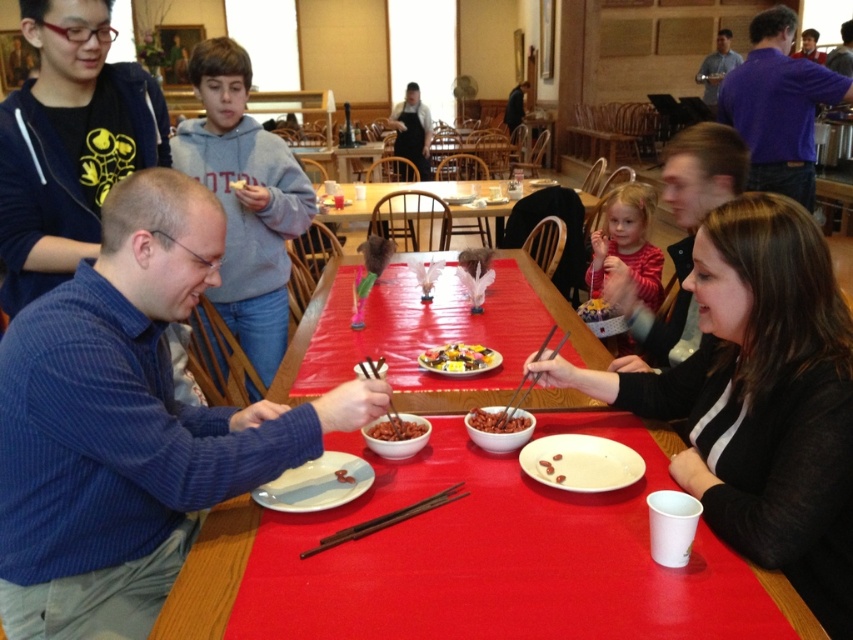
Who is lower down, gray fleece hoodie at upper left or brown matte beans at center?

brown matte beans at center is lower down.

Is point (184, 163) farther from camera compared to point (376, 438)?

Yes, it is.

What do you see at coordinates (245, 198) in the screenshot? I see `gray fleece hoodie at upper left` at bounding box center [245, 198].

Find the location of a particular element. This screenshot has height=640, width=853. gray fleece hoodie at upper left is located at coordinates (245, 198).

Can you confirm if blue shirt at upper right is smaller than brown matte nuts at center?

No.

Consider the image. Who is more distant from viewer, (x=704, y=90) or (x=554, y=477)?

Positioned behind is point (x=704, y=90).

Between point (722, 58) and point (543, 464), which one is positioned in front?

Point (543, 464) is more forward.

You are a GUI agent. You are given a task and a screenshot of the screen. Output one action in this format:
    pyautogui.click(x=<x>, y=<y>)
    Task: Click on the blue shirt at upper right
    
    Given the screenshot: What is the action you would take?
    pyautogui.click(x=717, y=67)

In the scene shown: Which is below, matte black hoodie at upper left or wooden table at center?

matte black hoodie at upper left

The image size is (853, 640). I want to click on matte black hoodie at upper left, so click(68, 144).